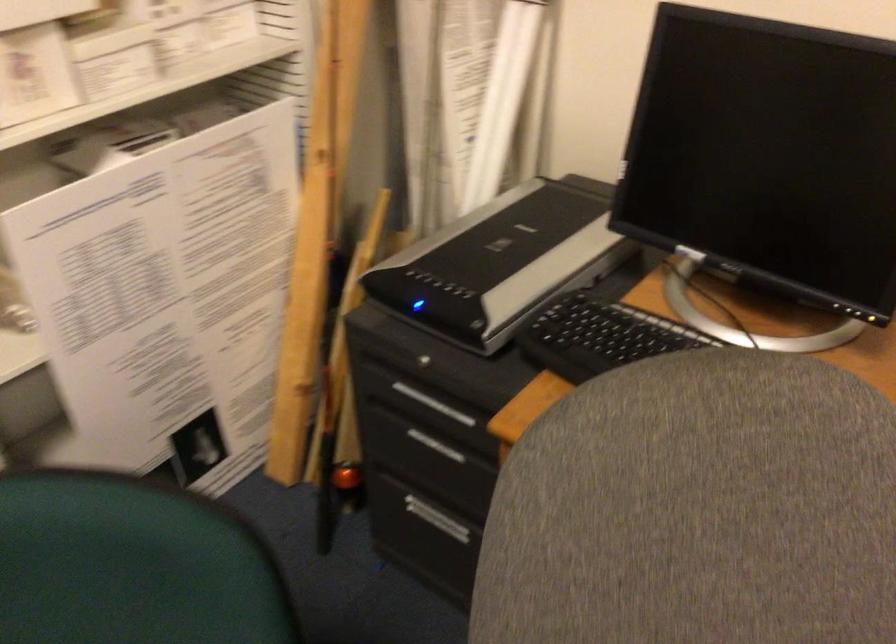
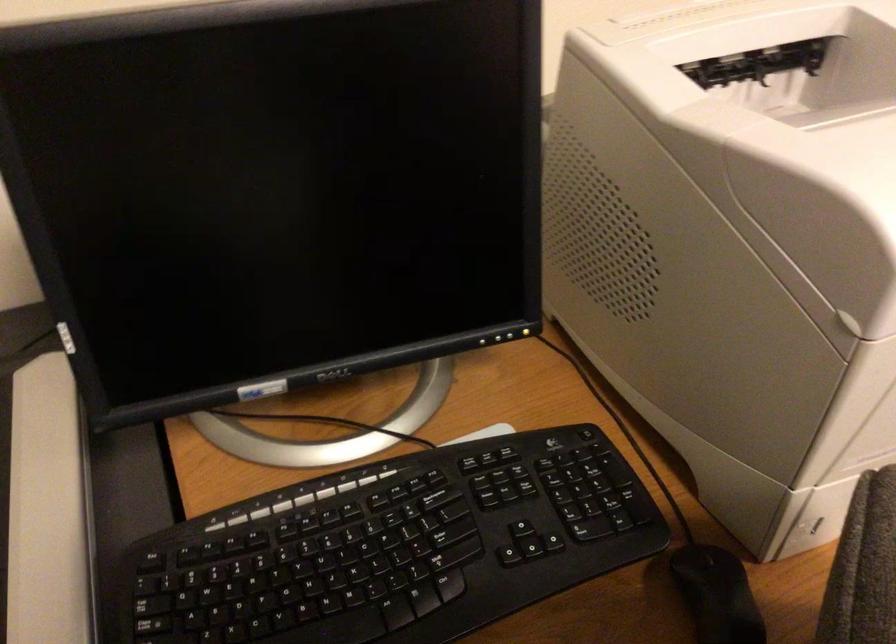
Locate, in the second image, the point that corresponds to point (583, 313) in the first image.

(178, 585)